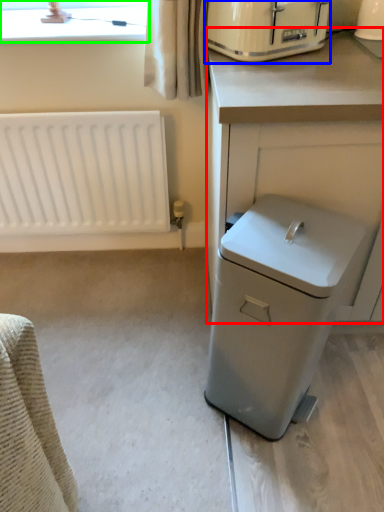
Question: Considering the real-world distances, which object is closest to counter (highlighted by a red box)? home appliance (highlighted by a blue box) or bay window (highlighted by a green box).

Choices:
 (A) home appliance
 (B) bay window

Answer: (A)